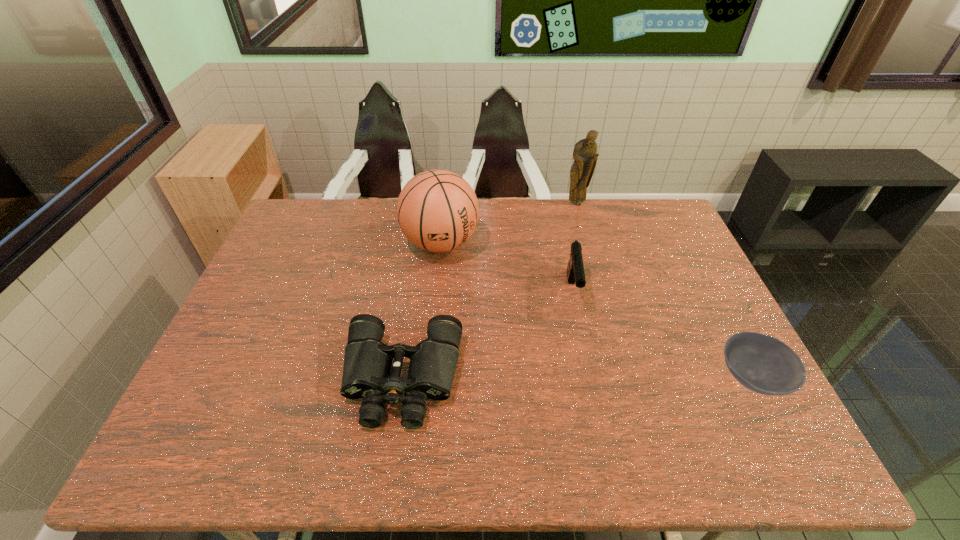
Find the location of a particular element. object that is the third nearest to the binoculars is located at coordinates pos(761,363).

Locate which object is the fourth closest to the third farthest object. Please provide its 2D coordinates. Your answer should be formatted as a tuple, i.e. [(x, y)], where the tuple contains the x and y coordinates of a point satisfying the conditions above.

[(585, 155)]

Identify the location of vacant region that satisfies the following two spatial constraints: 1. on the front side of the pistol; 2. on the right side of the shortest object. This screenshot has height=540, width=960. (590, 379).